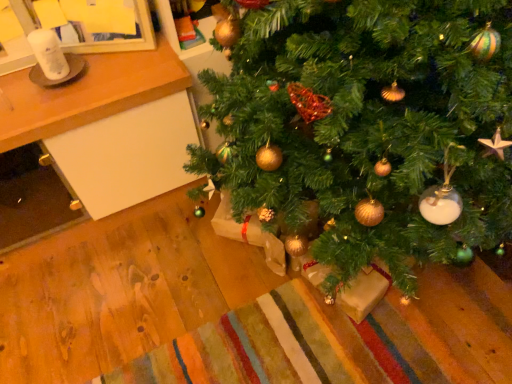
Where is `wooden table at lower left`? The image size is (512, 384). wooden table at lower left is located at coordinates (108, 126).

What do you see at coordinates (108, 126) in the screenshot?
I see `wooden table at lower left` at bounding box center [108, 126].

Measure the distance between wooden table at lower left and camera.

wooden table at lower left is 1.07 meters away from camera.

Where is `green matte christmas tree at center`? green matte christmas tree at center is located at coordinates (369, 128).

In order to face green matte christmas tree at center, should I rotate leftwards or rightwards?

Turn right by 14.763 degrees to look at green matte christmas tree at center.

What do you see at coordinates (369, 128) in the screenshot? Image resolution: width=512 pixels, height=384 pixels. I see `green matte christmas tree at center` at bounding box center [369, 128].

Locate an element on the screen. The height and width of the screenshot is (384, 512). wooden table at lower left is located at coordinates (108, 126).

Which is more to the right, green matte christmas tree at center or wooden table at lower left?

Positioned to the right is green matte christmas tree at center.

Which is in front, green matte christmas tree at center or wooden table at lower left?

green matte christmas tree at center is closer to the camera.

Which is in front, point (500, 10) or point (182, 115)?

The point (500, 10) is closer.

From the image's perspective, who appears lower, green matte christmas tree at center or wooden table at lower left?

wooden table at lower left.

From a real-world perspective, between green matte christmas tree at center and wooden table at lower left, who is vertically lower?

wooden table at lower left, from a real-world perspective.

Consider the image. Between green matte christmas tree at center and wooden table at lower left, which one has larger width?

Wider between the two is green matte christmas tree at center.

Considering the sizes of objects green matte christmas tree at center and wooden table at lower left in the image provided, who is shorter, green matte christmas tree at center or wooden table at lower left?

wooden table at lower left is shorter.

Does green matte christmas tree at center have a smaller size compared to wooden table at lower left?

No, green matte christmas tree at center is not smaller than wooden table at lower left.

Is green matte christmas tree at center located outside wooden table at lower left?

Indeed, green matte christmas tree at center is completely outside wooden table at lower left.

Is green matte christmas tree at center with wooden table at lower left?

green matte christmas tree at center and wooden table at lower left are clearly separated.

Is green matte christmas tree at center turned away from wooden table at lower left?

No, wooden table at lower left is not at the back of green matte christmas tree at center.

What's the angular difference between green matte christmas tree at center and wooden table at lower left's facing directions?

The angle between the facing direction of green matte christmas tree at center and the facing direction of wooden table at lower left is 89.6 degrees.

How much distance is there between green matte christmas tree at center and wooden table at lower left?

green matte christmas tree at center is 49.55 centimeters from wooden table at lower left.

The image size is (512, 384). What are the coordinates of `table below the green matte christmas tree at center (from the image's perspective)` in the screenshot? It's located at (108, 126).

Is wooden table at lower left at the right side of green matte christmas tree at center?

No, wooden table at lower left is not to the right of green matte christmas tree at center.

Is wooden table at lower left in front of or behind green matte christmas tree at center in the image?

In the image, wooden table at lower left appears behind green matte christmas tree at center.

Does point (157, 134) come behind point (255, 107)?

Yes, it is behind point (255, 107).

From the image's perspective, is wooden table at lower left located above or below green matte christmas tree at center?

wooden table at lower left is below green matte christmas tree at center.

From a real-world perspective, which is physically below, wooden table at lower left or green matte christmas tree at center?

In real-world perspective, wooden table at lower left is lower.

Can you confirm if wooden table at lower left is wider than green matte christmas tree at center?

In fact, wooden table at lower left might be narrower than green matte christmas tree at center.

Which of these two, wooden table at lower left or green matte christmas tree at center, stands taller?

Standing taller between the two is green matte christmas tree at center.

Does wooden table at lower left have a smaller size compared to green matte christmas tree at center?

Yes, wooden table at lower left is smaller than green matte christmas tree at center.

Is wooden table at lower left surrounding green matte christmas tree at center?

No, wooden table at lower left does not contain green matte christmas tree at center.

Is wooden table at lower left beside green matte christmas tree at center?

wooden table at lower left is not next to green matte christmas tree at center, and they're not touching.

Is wooden table at lower left facing towards green matte christmas tree at center?

No, wooden table at lower left is not oriented towards green matte christmas tree at center.

How much distance is there between wooden table at lower left and green matte christmas tree at center?

wooden table at lower left is 19.51 inches from green matte christmas tree at center.

The width and height of the screenshot is (512, 384). I want to click on christmas tree located above the wooden table at lower left (from the image's perspective), so tap(369, 128).

Locate an element on the screen. This screenshot has height=384, width=512. christmas tree on the right of wooden table at lower left is located at coordinates (369, 128).

Where is `table on the left of green matte christmas tree at center`? This screenshot has width=512, height=384. table on the left of green matte christmas tree at center is located at coordinates (108, 126).